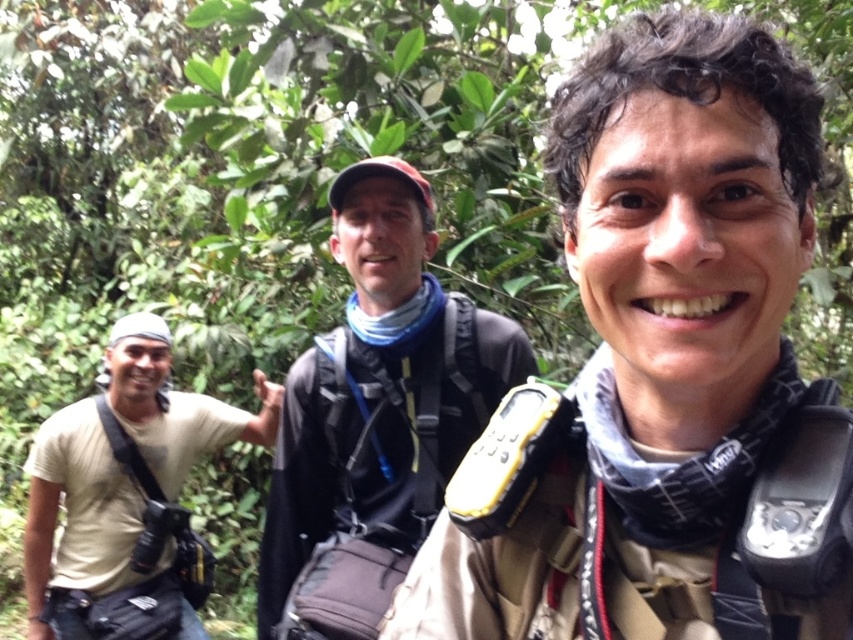
You are standing in the forest and want to determine which of the two points, point [316,396] or point [80,536], is closer to you. Based on the scene, can you identify which point is nearer?

Point [316,396] is closer to the viewer than point [80,536].